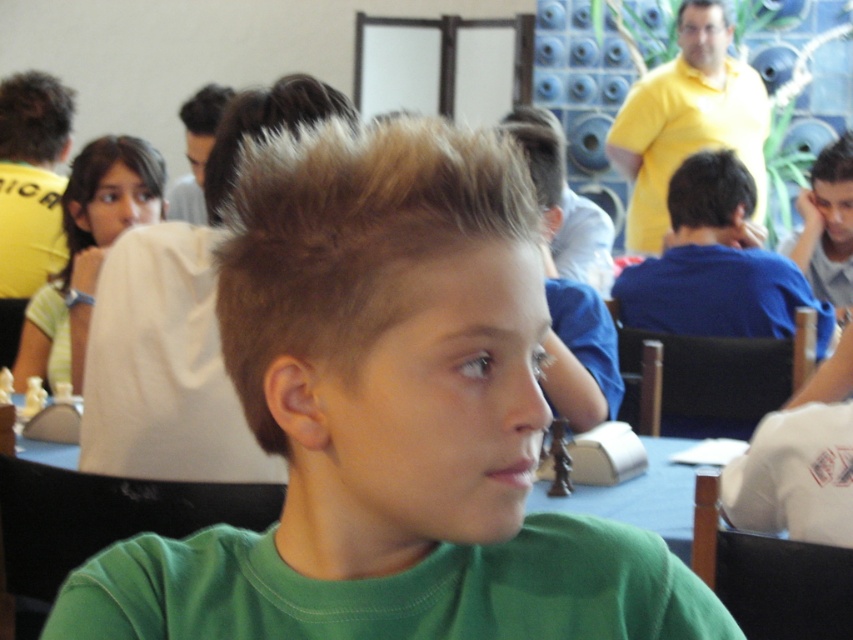
You are a photographer at the chess tournament. You want to take a photo of both the light brown hair at upper left and slicked brown hair at upper right in the same frame. Considering their heights, which one should you adjust the camera angle to focus on to ensure both are visible?

Since the light brown hair at upper left is taller than the slicked brown hair at upper right, you should lower the camera angle slightly to capture the taller individual while still including the shorter one in the frame.

You are a photographer trying to capture a candid shot of the light brown hair at upper left and dark brown hair at upper left. Which one is positioned lower in the frame?

The light brown hair at upper left is located below dark brown hair at upper left, so the light brown hair at upper left is positioned lower in the frame.